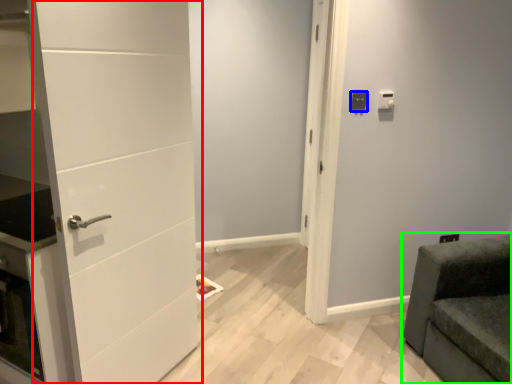
Question: Which object is positioned farthest from door (highlighted by a red box)? Select from light switch (highlighted by a blue box) and furniture (highlighted by a green box).

Choices:
 (A) light switch
 (B) furniture

Answer: (B)